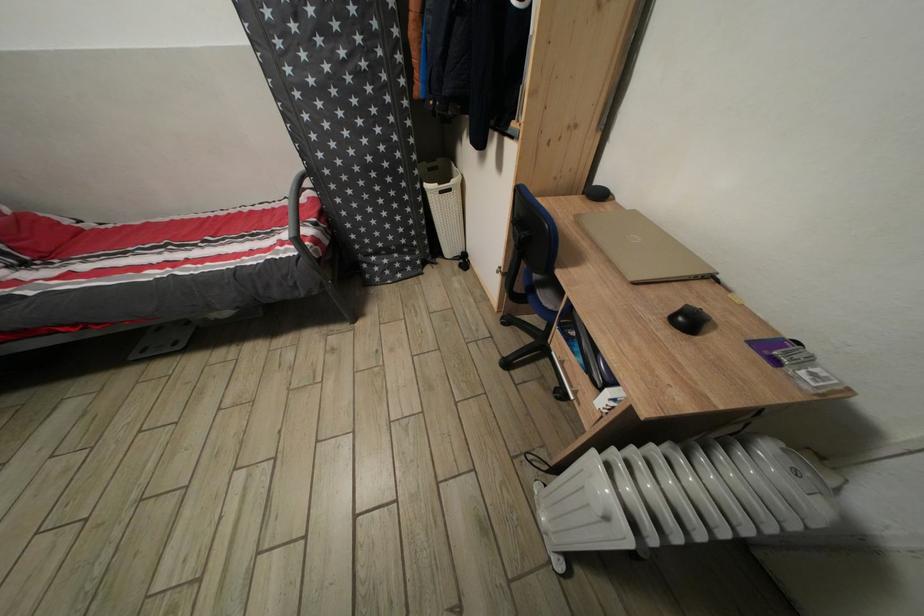
Image resolution: width=924 pixels, height=616 pixels. Identify the location of heater handle. (657, 501).